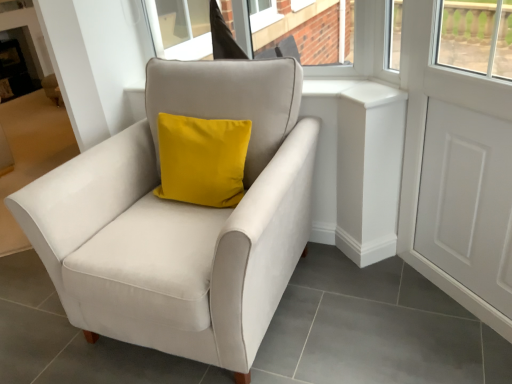
Question: Does satin beige armchair at center have a greater height compared to white matte screen door at right?

Choices:
 (A) no
 (B) yes

Answer: (A)

Question: Is satin beige armchair at center shorter than white matte screen door at right?

Choices:
 (A) yes
 (B) no

Answer: (A)

Question: From a real-world perspective, does satin beige armchair at center sit lower than white matte screen door at right?

Choices:
 (A) no
 (B) yes

Answer: (B)

Question: Is satin beige armchair at center completely or partially outside of white matte screen door at right?

Choices:
 (A) no
 (B) yes

Answer: (B)

Question: From the image's perspective, does satin beige armchair at center appear higher than white matte screen door at right?

Choices:
 (A) yes
 (B) no

Answer: (B)

Question: Is satin beige armchair at center bigger than white matte screen door at right?

Choices:
 (A) no
 (B) yes

Answer: (B)

Question: Is white matte screen door at right far away from satin beige armchair at center?

Choices:
 (A) no
 (B) yes

Answer: (A)

Question: Can you see white matte screen door at right touching satin beige armchair at center?

Choices:
 (A) yes
 (B) no

Answer: (B)

Question: Is satin beige armchair at center inside white matte screen door at right?

Choices:
 (A) no
 (B) yes

Answer: (A)

Question: From a real-world perspective, is white matte screen door at right physically above satin beige armchair at center?

Choices:
 (A) yes
 (B) no

Answer: (A)

Question: Is white matte screen door at right shorter than satin beige armchair at center?

Choices:
 (A) yes
 (B) no

Answer: (B)

Question: Can you confirm if white matte screen door at right is positioned to the left of satin beige armchair at center?

Choices:
 (A) yes
 (B) no

Answer: (B)

Question: Considering their positions, is white matte screen door at right located in front of or behind satin beige armchair at center?

Choices:
 (A) behind
 (B) front

Answer: (A)